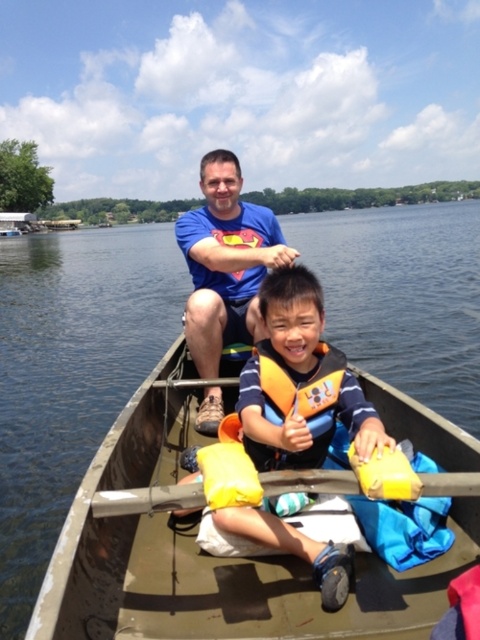
You are planning to store the yellow foam life jacket at center and the yellow foam paddle at center in a storage compartment. Which one should you place first to ensure they both fit properly?

The yellow foam paddle at center is on the left side of the yellow foam life jacket at center, so you should place the life jacket first to make space for the paddle.

You are a photographer trying to capture a clear photo of the matte blue shirt at center and the yellow foam paddle at center. Since you want to focus on both objects, which one should you adjust your camera lens to prioritize focusing on first?

The matte blue shirt at center is located above the yellow foam paddle at center, so you should prioritize focusing on the matte blue shirt at center first as it is closer to the camera.